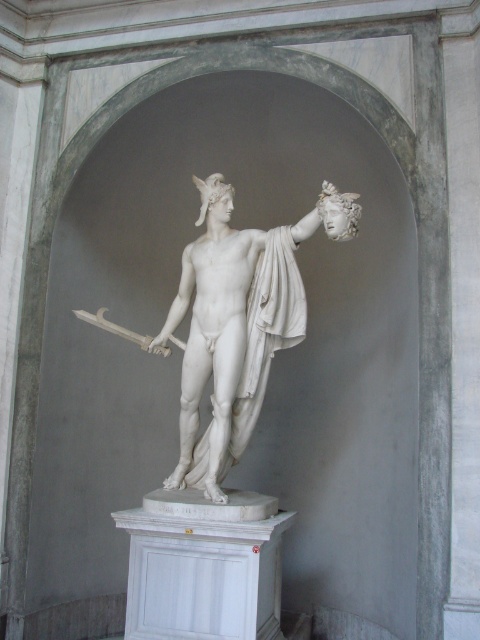
You are an art restorer examining the classical marble statue. You notice two points on the statue marked at coordinates point (x=291, y=337) and point (x=126, y=337). Which point is closer to you?

Point (x=291, y=337) is closer to the viewer than point (x=126, y=337).

You are an art curator planning to install a protective glass barrier around the white marble statue at center and the polished silver sword at center. To ensure both are fully visible, where should you position the barrier relative to each object?

The white marble statue at center is in front of the polished silver sword at center, so the barrier should be placed around both objects, ensuring the statue is in front and the sword is positioned behind it to maintain visibility.